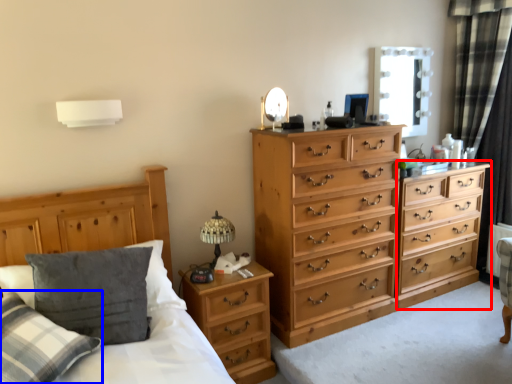
Question: Which object is further to the camera taking this photo, chest of drawers (highlighted by a red box) or pillow (highlighted by a blue box)?

Choices:
 (A) chest of drawers
 (B) pillow

Answer: (A)